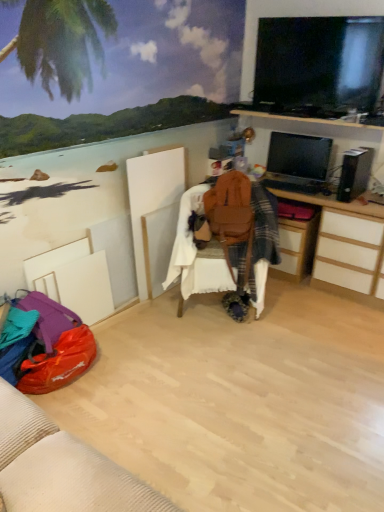
Question: In terms of width, does brown leather bean bag chair at center look wider or thinner when compared to black glossy flat-screen tv at upper right, which appears as the first television when viewed from the top?

Choices:
 (A) wide
 (B) thin

Answer: (A)

Question: Do you think brown leather bean bag chair at center is within black glossy flat-screen tv at upper right, which appears as the second television when ordered from the bottom, or outside of it?

Choices:
 (A) inside
 (B) outside

Answer: (B)

Question: Estimate the real-world distances between objects in this image. Which object is closer to the brown leather bean bag chair at center?

Choices:
 (A) matte black monitor at upper right, which ranks as the 2th television in top-to-bottom order
 (B) wooden computer desk at center right
 (C) wooden drawer at center-right
 (D) black glossy flat-screen tv at upper right, which appears as the second television when ordered from the bottom

Answer: (C)

Question: Considering the real-world distances, which object is closest to the black glossy flat-screen tv at upper right, which appears as the second television when ordered from the bottom?

Choices:
 (A) matte black monitor at upper right, the 1th television ordered from the bottom
 (B) wooden computer desk at center right
 (C) brown leather bean bag chair at center
 (D) wooden drawer at center-right

Answer: (B)